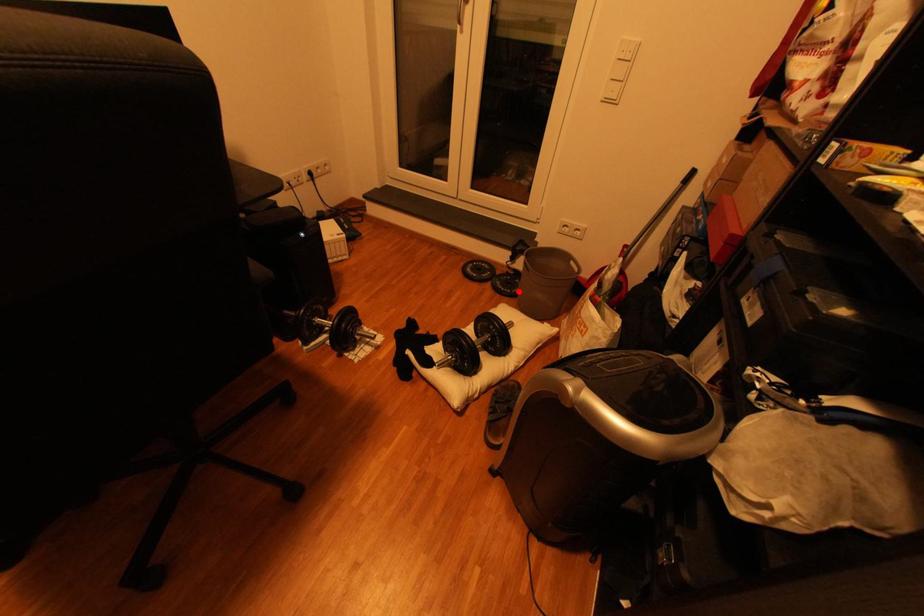
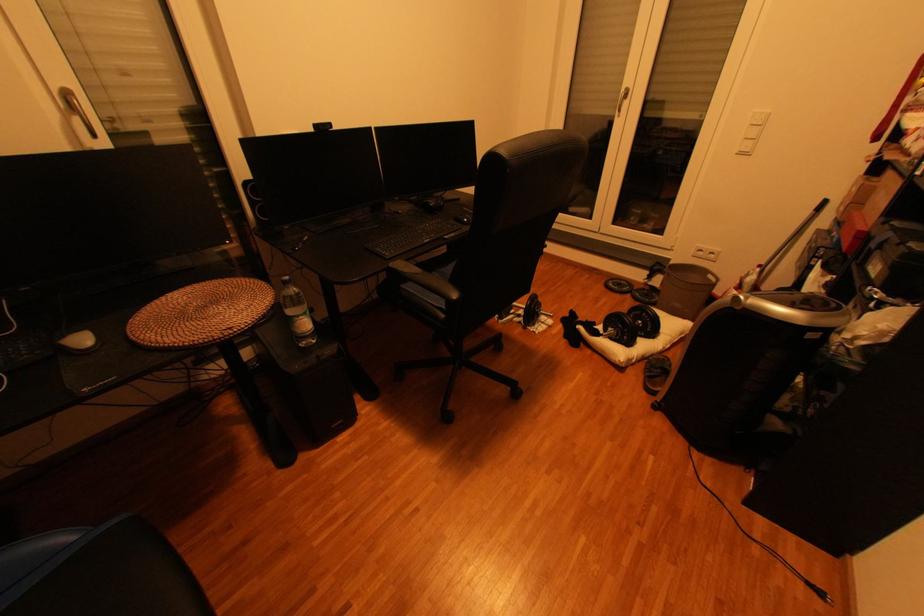
Find the pixel in the second image that matches the highlighted location in the first image.

(658, 301)